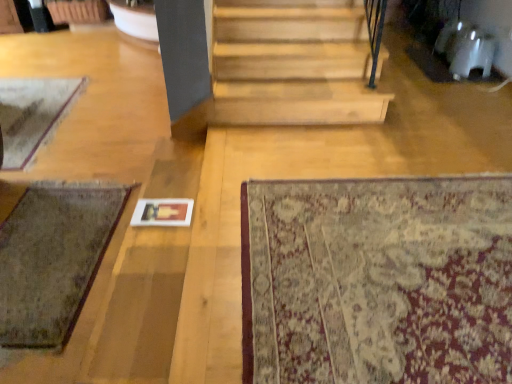
What do you see at coordinates (53, 259) in the screenshot? I see `green woolen mat at lower left, the second mat positioned from the left` at bounding box center [53, 259].

The width and height of the screenshot is (512, 384). Identify the location of green woolen mat at lower left, acting as the second mat starting from the right. (53, 259).

Who is smaller, beige floral rug at lower right, acting as the 1th mat starting from the right, or worn wool mat at lower left, the first mat positioned from the back?

Smaller between the two is worn wool mat at lower left, the first mat positioned from the back.

Would you consider beige floral rug at lower right, acting as the 1th mat starting from the front, to be distant from worn wool mat at lower left, placed as the third mat when sorted from right to left?

beige floral rug at lower right, acting as the 1th mat starting from the front, is far away from worn wool mat at lower left, placed as the third mat when sorted from right to left.

From a real-world perspective, is beige floral rug at lower right, which is counted as the 3th mat, starting from the back, over worn wool mat at lower left, placed as the third mat when sorted from right to left?

Yes, from a real-world perspective, beige floral rug at lower right, which is counted as the 3th mat, starting from the back, is above worn wool mat at lower left, placed as the third mat when sorted from right to left.

Measure the distance from beige floral rug at lower right, the 3th mat from the left, to worn wool mat at lower left, acting as the first mat starting from the left.

2.39 meters.

Between beige floral rug at lower right, which is counted as the 3th mat, starting from the back, and green woolen mat at lower left, which is the second mat from front to back, which one appears on the right side from the viewer's perspective?

beige floral rug at lower right, which is counted as the 3th mat, starting from the back.

Is beige floral rug at lower right, acting as the 1th mat starting from the front, inside or outside of green woolen mat at lower left, acting as the second mat starting from the right?

beige floral rug at lower right, acting as the 1th mat starting from the front, is spatially situated outside green woolen mat at lower left, acting as the second mat starting from the right.

How much distance is there between beige floral rug at lower right, which is counted as the 3th mat, starting from the back, and green woolen mat at lower left, the second mat viewed from the back?

3.94 feet.

Could you tell me if worn wool mat at lower left, the first mat positioned from the back, is turned towards green woolen mat at lower left, the second mat viewed from the back?

No, worn wool mat at lower left, the first mat positioned from the back, is not turned towards green woolen mat at lower left, the second mat viewed from the back.

Locate an element on the screen. This screenshot has width=512, height=384. mat lying on the left of green woolen mat at lower left, the second mat positioned from the left is located at coordinates click(31, 113).

Does worn wool mat at lower left, acting as the first mat starting from the left, have a greater width compared to green woolen mat at lower left, which is the second mat from front to back?

Correct, the width of worn wool mat at lower left, acting as the first mat starting from the left, exceeds that of green woolen mat at lower left, which is the second mat from front to back.

Is worn wool mat at lower left, acting as the 3th mat starting from the front, beside green woolen mat at lower left, acting as the second mat starting from the right?

worn wool mat at lower left, acting as the 3th mat starting from the front, and green woolen mat at lower left, acting as the second mat starting from the right, are clearly separated.

From the image's perspective, which object appears higher, green woolen mat at lower left, acting as the second mat starting from the right, or worn wool mat at lower left, acting as the first mat starting from the left?

worn wool mat at lower left, acting as the first mat starting from the left, is shown above in the image.

Does green woolen mat at lower left, the second mat positioned from the left, have a lesser width compared to worn wool mat at lower left, placed as the third mat when sorted from right to left?

Indeed, green woolen mat at lower left, the second mat positioned from the left, has a lesser width compared to worn wool mat at lower left, placed as the third mat when sorted from right to left.

Does point (106, 199) appear closer or farther from the camera than point (50, 113)?

Point (106, 199) appears to be closer to the viewer than point (50, 113).

Considering the points (20, 102) and (326, 238), which point is in front, point (20, 102) or point (326, 238)?

The point (326, 238) is more forward.

Locate an element on the screen. mat that is the 2nd object to the left of the beige floral rug at lower right, which is counted as the 3th mat, starting from the back, starting at the anchor is located at coordinates (31, 113).

Between worn wool mat at lower left, the first mat positioned from the back, and beige floral rug at lower right, acting as the 1th mat starting from the front, which one has more height?

With more height is worn wool mat at lower left, the first mat positioned from the back.

From a real-world perspective, is worn wool mat at lower left, acting as the 3th mat starting from the front, under beige floral rug at lower right, acting as the 1th mat starting from the right?

Correct, in the physical world, worn wool mat at lower left, acting as the 3th mat starting from the front, is lower than beige floral rug at lower right, acting as the 1th mat starting from the right.

Visually, is green woolen mat at lower left, which is the second mat from front to back, positioned to the left or to the right of beige floral rug at lower right, the 3th mat from the left?

green woolen mat at lower left, which is the second mat from front to back, is positioned on beige floral rug at lower right, the 3th mat from the left,'s left side.

Is green woolen mat at lower left, the second mat viewed from the back, inside the boundaries of beige floral rug at lower right, which is counted as the 3th mat, starting from the back, or outside?

green woolen mat at lower left, the second mat viewed from the back, cannot be found inside beige floral rug at lower right, which is counted as the 3th mat, starting from the back.

How different are the orientations of green woolen mat at lower left, acting as the second mat starting from the right, and beige floral rug at lower right, acting as the 1th mat starting from the right, in degrees?

green woolen mat at lower left, acting as the second mat starting from the right, and beige floral rug at lower right, acting as the 1th mat starting from the right, are facing 91.2 degrees away from each other.

Where is `the 2nd mat to the left of the beige floral rug at lower right, the 3th mat from the left, starting your count from the anchor`? This screenshot has height=384, width=512. the 2nd mat to the left of the beige floral rug at lower right, the 3th mat from the left, starting your count from the anchor is located at coordinates (31, 113).

Locate an element on the screen. The width and height of the screenshot is (512, 384). mat in front of the green woolen mat at lower left, the second mat positioned from the left is located at coordinates (377, 281).

Considering their positions, is green woolen mat at lower left, which is the second mat from front to back, positioned further to beige floral rug at lower right, acting as the 1th mat starting from the front, than worn wool mat at lower left, acting as the 3th mat starting from the front?

Among the two, worn wool mat at lower left, acting as the 3th mat starting from the front, is located further to beige floral rug at lower right, acting as the 1th mat starting from the front.

Estimate the real-world distances between objects in this image. Which object is closer to green woolen mat at lower left, acting as the second mat starting from the right, worn wool mat at lower left, the first mat positioned from the back, or beige floral rug at lower right, the 3th mat from the left?

worn wool mat at lower left, the first mat positioned from the back.

Estimate the real-world distances between objects in this image. Which object is further from worn wool mat at lower left, the first mat positioned from the back, beige floral rug at lower right, the 3th mat from the left, or green woolen mat at lower left, the second mat viewed from the back?

Among the two, beige floral rug at lower right, the 3th mat from the left, is located further to worn wool mat at lower left, the first mat positioned from the back.

From the image, which object appears to be farther from worn wool mat at lower left, placed as the third mat when sorted from right to left, green woolen mat at lower left, the second mat positioned from the left, or beige floral rug at lower right, which is counted as the 3th mat, starting from the back?

beige floral rug at lower right, which is counted as the 3th mat, starting from the back, lies further to worn wool mat at lower left, placed as the third mat when sorted from right to left, than the other object.

Which object lies further to the anchor point beige floral rug at lower right, acting as the 1th mat starting from the right, worn wool mat at lower left, placed as the third mat when sorted from right to left, or green woolen mat at lower left, the second mat positioned from the left?

worn wool mat at lower left, placed as the third mat when sorted from right to left, is positioned further to the anchor beige floral rug at lower right, acting as the 1th mat starting from the right.

Considering their positions, is beige floral rug at lower right, acting as the 1th mat starting from the front, positioned closer to green woolen mat at lower left, the second mat viewed from the back, than worn wool mat at lower left, placed as the third mat when sorted from right to left?

worn wool mat at lower left, placed as the third mat when sorted from right to left.

You are a GUI agent. You are given a task and a screenshot of the screen. Output one action in this format:
    pyautogui.click(x=<x>, y=<y>)
    Task: Click on the mat situated between worn wool mat at lower left, acting as the first mat starting from the left, and beige floral rug at lower right, the 3th mat from the left, from left to right
    The image size is (512, 384).
    Given the screenshot: What is the action you would take?
    pyautogui.click(x=53, y=259)